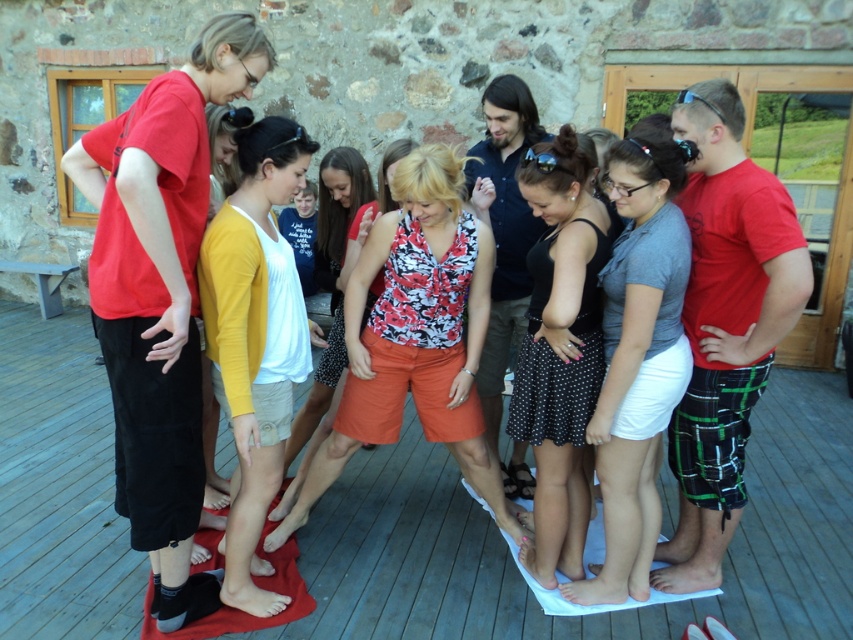
Question: Which object is farther from the camera taking this photo?

Choices:
 (A) gray matte skirt at center
 (B) floral print blouse at center

Answer: (B)

Question: Does wooden deck at center appear over floral print blouse at center?

Choices:
 (A) no
 (B) yes

Answer: (A)

Question: Which point is closer to the camera?

Choices:
 (A) (267, 163)
 (B) (155, 257)
 (C) (16, 356)

Answer: (B)

Question: Does gray matte skirt at center lie in front of yellow cotton cardigan at center?

Choices:
 (A) yes
 (B) no

Answer: (B)

Question: Based on their relative distances, which object is nearer to the gray matte skirt at center?

Choices:
 (A) black dotted skirt at center
 (B) yellow cotton cardigan at center
 (C) floral print tank top at center
 (D) matte red shirt at left

Answer: (A)

Question: Can you confirm if matte red shirt at left is positioned above yellow cotton cardigan at center?

Choices:
 (A) yes
 (B) no

Answer: (A)